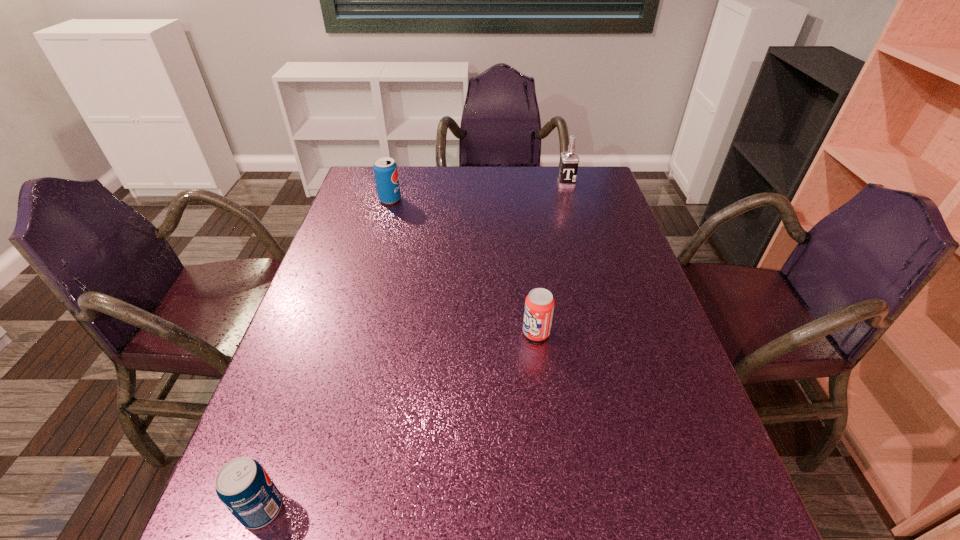
The height and width of the screenshot is (540, 960). What are the coordinates of `the rightmost object` in the screenshot? It's located at (569, 161).

Locate an element on the screen. This screenshot has width=960, height=540. the farthest object is located at coordinates (569, 161).

You are a GUI agent. You are given a task and a screenshot of the screen. Output one action in this format:
    pyautogui.click(x=<x>, y=<y>)
    Task: Click on the farthest soda can
    This screenshot has height=540, width=960.
    Given the screenshot: What is the action you would take?
    pyautogui.click(x=385, y=169)

Find the location of `the nearest soda can`. the nearest soda can is located at coordinates (244, 487).

Find the location of `the second nearest soda can`. the second nearest soda can is located at coordinates coord(539,305).

Locate an element on the screen. The image size is (960, 540). the third farthest object is located at coordinates (539, 305).

This screenshot has width=960, height=540. Find the location of `free space located on the front label of the vodka`. free space located on the front label of the vodka is located at coordinates (579, 228).

At what (x,y) coordinates should I click in order to perform the action: click on free space located on the right of the second farthest object. Please return your answer as a coordinate pair (x, y). This screenshot has height=540, width=960. Looking at the image, I should click on (428, 199).

The height and width of the screenshot is (540, 960). I want to click on vacant space located on the right of the nearest object, so click(x=420, y=509).

You are a GUI agent. You are given a task and a screenshot of the screen. Output one action in this format:
    pyautogui.click(x=<x>, y=<y>)
    Task: Click on the free space located 0.310m on the surface of the second nearest object
    This screenshot has height=540, width=960.
    Given the screenshot: What is the action you would take?
    pyautogui.click(x=389, y=333)